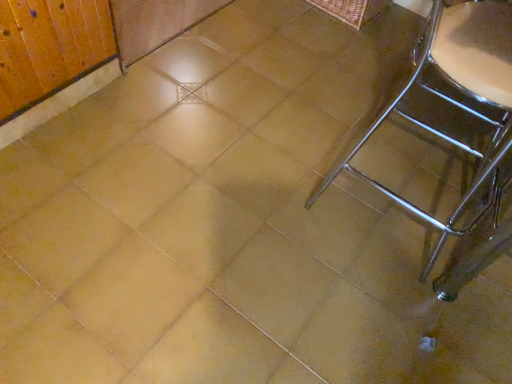
Image resolution: width=512 pixels, height=384 pixels. I want to click on free point behind polished chrome chair at right, so click(359, 129).